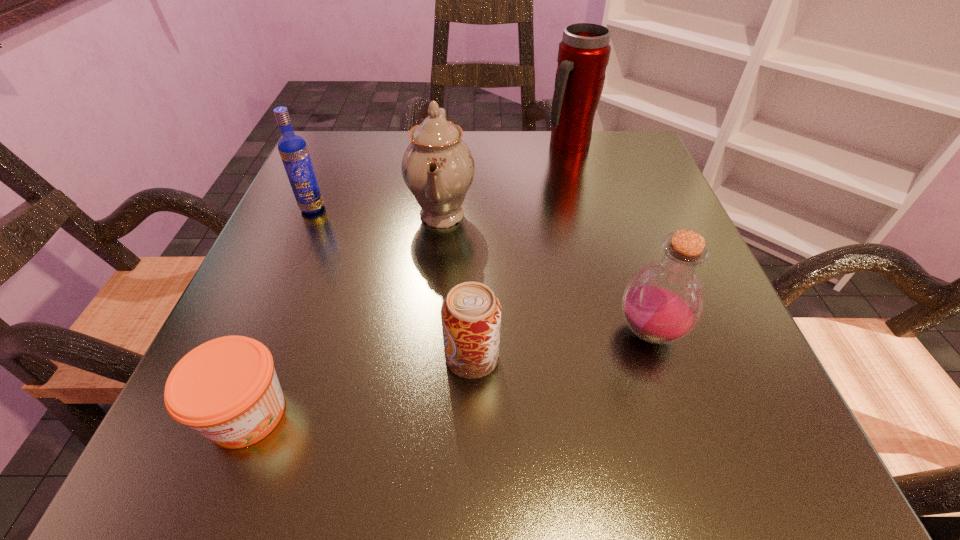
I want to click on free region at the far edge of the desktop, so click(492, 155).

I want to click on vacant space at the near edge, so [651, 464].

This screenshot has height=540, width=960. In order to click on free location at the left edge in this screenshot , I will do `click(271, 252)`.

Find the location of a particular element. The width and height of the screenshot is (960, 540). vacant space at the right edge is located at coordinates (716, 320).

Where is `vacant region at the far left corner`? vacant region at the far left corner is located at coordinates (328, 157).

The width and height of the screenshot is (960, 540). In the image, there is a desktop. Find the location of `vacant space at the near right corner`. vacant space at the near right corner is located at coordinates coord(770,446).

This screenshot has width=960, height=540. What are the coordinates of `vacant space that's between the bottle and the vodka` in the screenshot? It's located at (481, 270).

Locate an element on the screen. The image size is (960, 540). free space between the bottle and the shortest object is located at coordinates (448, 373).

You are a GUI agent. You are given a task and a screenshot of the screen. Output one action in this format:
    pyautogui.click(x=<x>, y=<y>)
    Task: Click on the vacant region between the vodka and the chinaware
    
    Given the screenshot: What is the action you would take?
    pyautogui.click(x=377, y=211)

You are a GUI agent. You are given a task and a screenshot of the screen. Output one action in this format:
    pyautogui.click(x=<x>, y=<y>)
    Task: Click on the vacant area between the vodka and the beer can
    Image resolution: width=960 pixels, height=540 pixels.
    Given the screenshot: What is the action you would take?
    pyautogui.click(x=393, y=282)